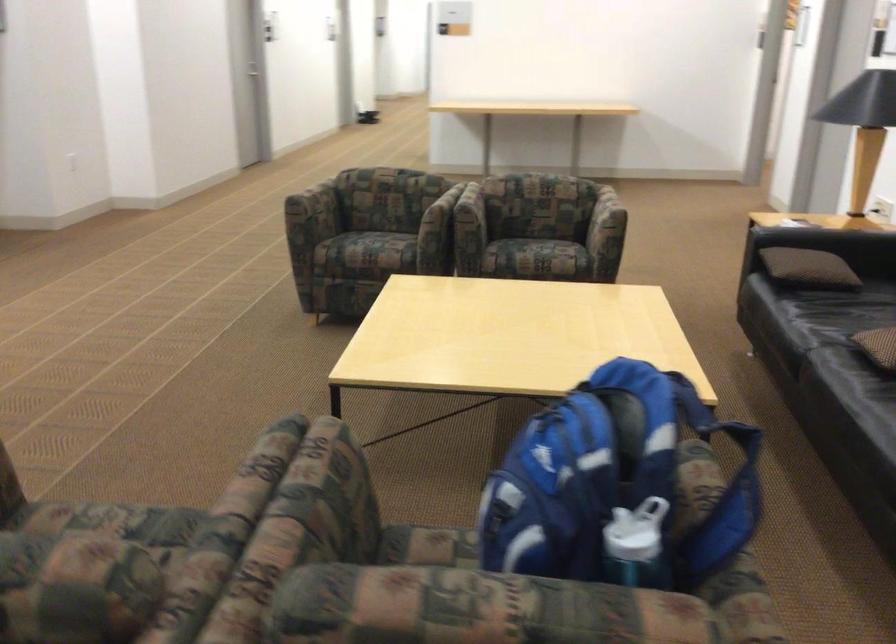
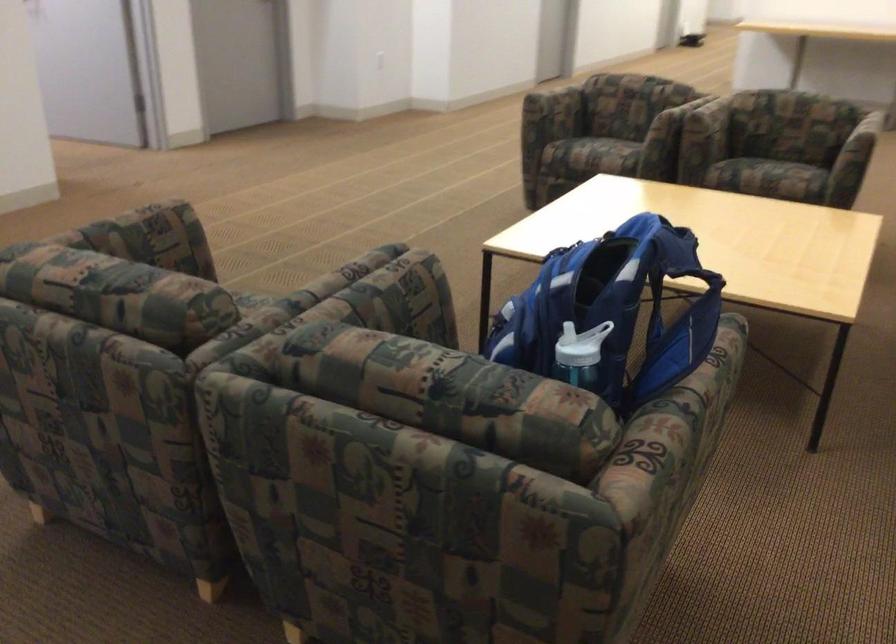
The point at (375, 252) is marked in the first image. Where is the corresponding point in the second image?

(597, 152)